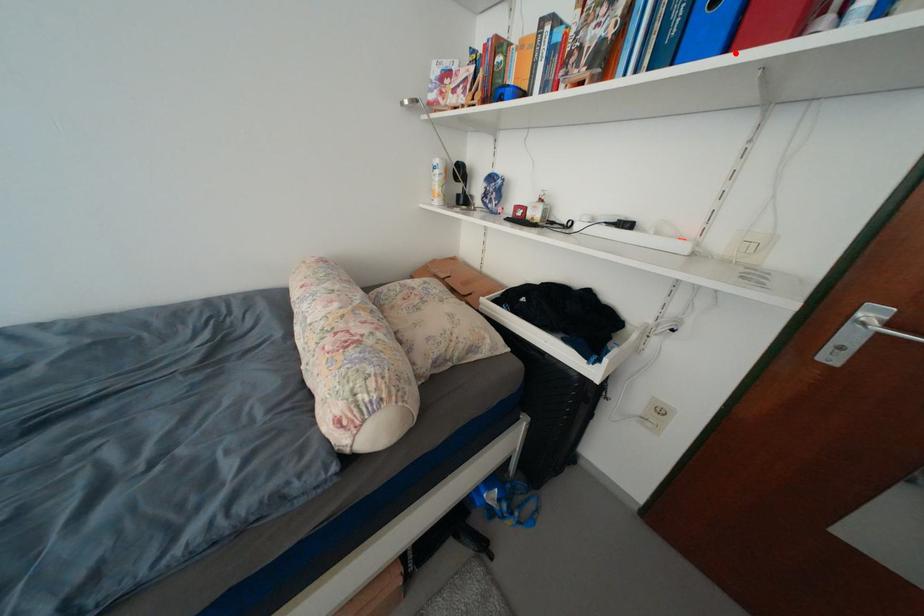
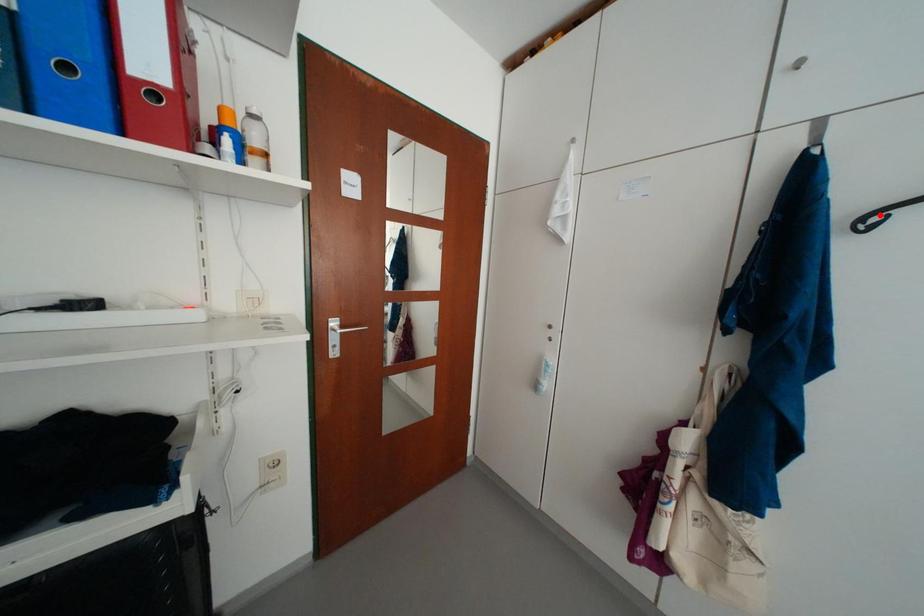
I am providing you with two images of the same scene from different viewpoints. A red point is marked on the first image and another point is marked on the second image. Is the marked point in image1 the same physical position as the marked point in image2?

No